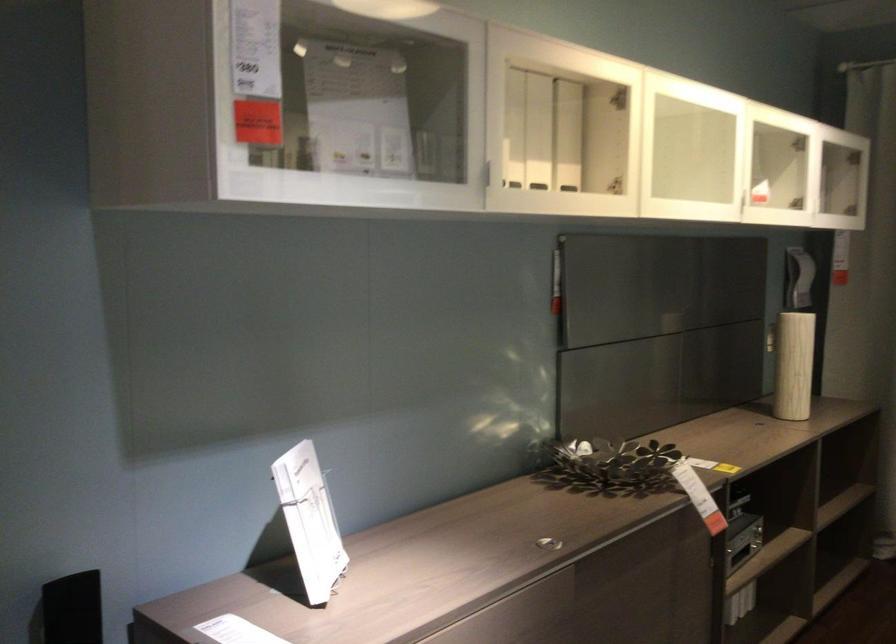
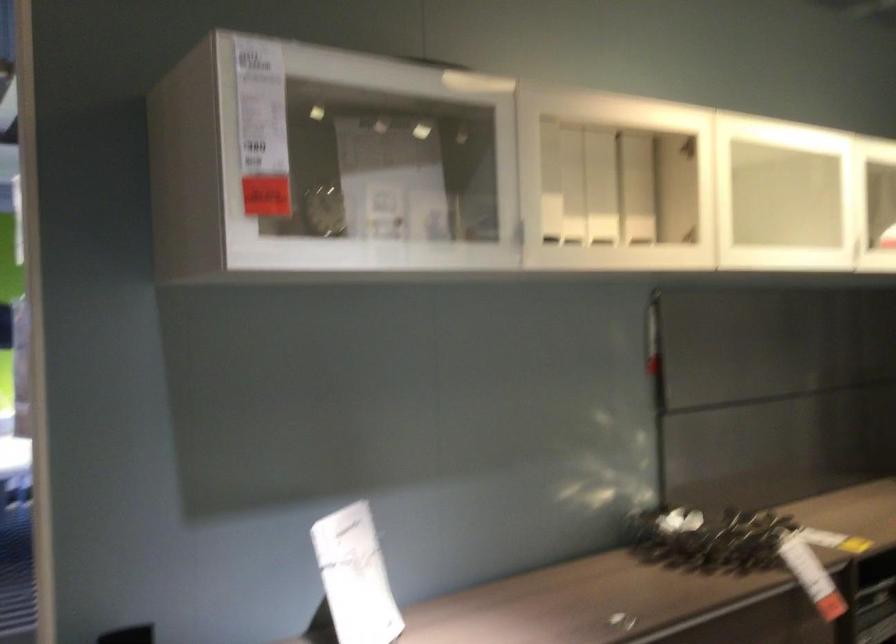
The point at (615, 185) is marked in the first image. Where is the corresponding point in the second image?

(690, 234)